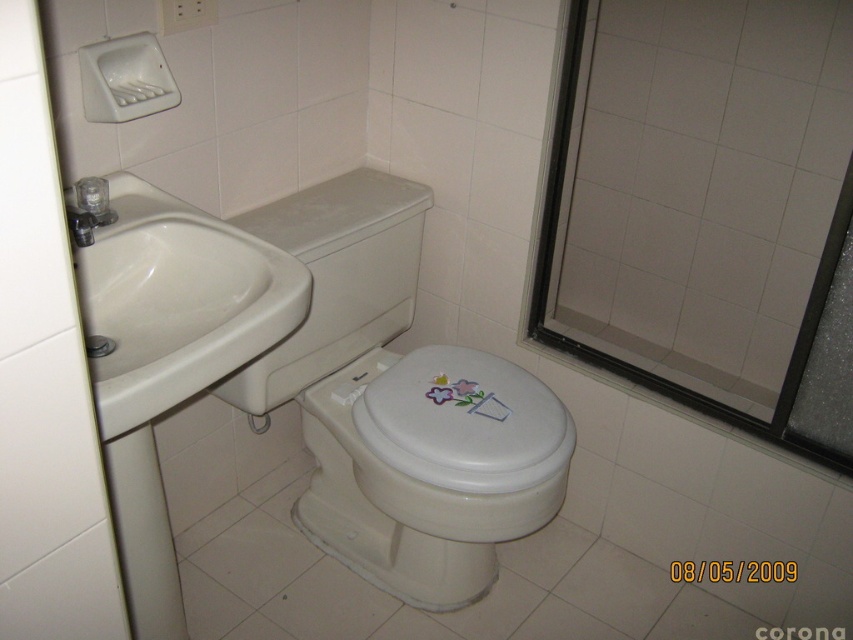
Who is positioned more to the right, transparent glass door at upper right or white glossy toilet at center?

transparent glass door at upper right is more to the right.

Between point (721, 400) and point (374, 358), which one is positioned in front?

Point (374, 358)

At what (x,y) coordinates should I click in order to perform the action: click on transparent glass door at upper right. Please return your answer as a coordinate pair (x, y). The height and width of the screenshot is (640, 853). Looking at the image, I should click on (706, 209).

Does point (386, 564) lie behind point (495, 426)?

Yes, it is behind point (495, 426).

What do you see at coordinates (399, 404) in the screenshot? This screenshot has width=853, height=640. I see `white glossy toilet at center` at bounding box center [399, 404].

Between point (358, 406) and point (434, 444), which one is positioned in front?

Point (434, 444) is more forward.

You are a GUI agent. You are given a task and a screenshot of the screen. Output one action in this format:
    pyautogui.click(x=<x>, y=<y>)
    Task: Click on the white glossy toilet at center
    Image resolution: width=853 pixels, height=640 pixels.
    Given the screenshot: What is the action you would take?
    pyautogui.click(x=399, y=404)

Is white glossy toilet at center positioned behind white glossy sink at left?

Yes, white glossy toilet at center is further from the viewer.

Image resolution: width=853 pixels, height=640 pixels. What do you see at coordinates (399, 404) in the screenshot?
I see `white glossy toilet at center` at bounding box center [399, 404].

Where is `white glossy toilet at center`? Image resolution: width=853 pixels, height=640 pixels. white glossy toilet at center is located at coordinates (399, 404).